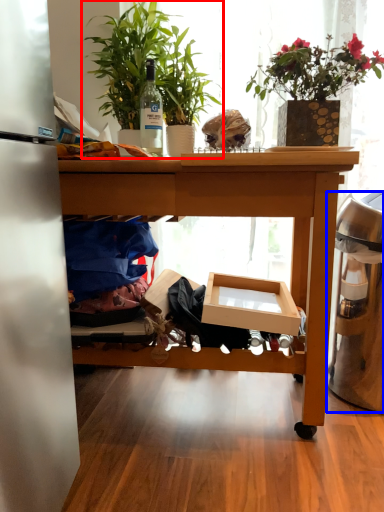
Question: Which object appears closest to the camera in this image, houseplant (highlighted by a red box) or trash bin/can (highlighted by a blue box)?

Choices:
 (A) houseplant
 (B) trash bin/can

Answer: (A)